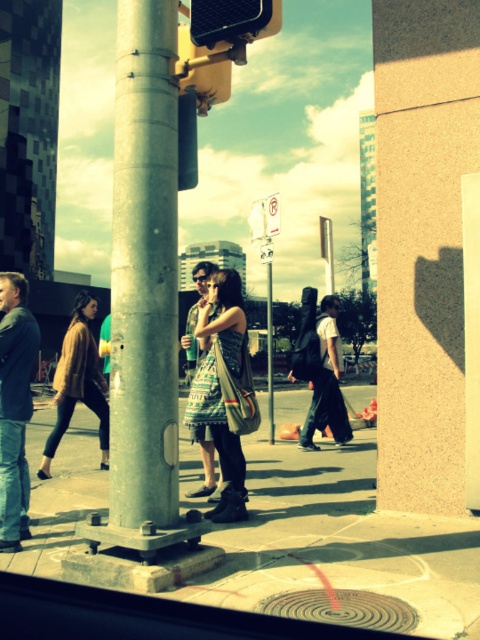
Where is `concrete pole at center`? This screenshot has height=640, width=480. concrete pole at center is located at coordinates (144, 268).

Which of these two, concrete pole at center or metallic pole at center, stands taller?

metallic pole at center is taller.

Which is in front, point (116, 305) or point (271, 412)?

Point (116, 305) is more forward.

Where is `concrete pole at center`? The width and height of the screenshot is (480, 640). concrete pole at center is located at coordinates (144, 268).

Does point (256, 564) come in front of point (269, 259)?

Yes, it is.

Which is more to the right, smooth concrete sidewalk at center or metallic rectangular sign at center?

metallic rectangular sign at center is more to the right.

Is point (462, 541) positioned before point (269, 243)?

Yes, it is.

Locate an element on the screen. This screenshot has height=640, width=480. smooth concrete sidewalk at center is located at coordinates (339, 540).

Does dark gray backpack at center come behind matte brown cardigan at lower left?

Yes.

Is point (330, 342) positioned in front of point (96, 385)?

No, (330, 342) is further to viewer.

Is point (328, 346) less distant than point (52, 429)?

No, (328, 346) is behind (52, 429).

Image resolution: width=480 pixels, height=640 pixels. What are the coordinates of `dark gray backpack at center` in the screenshot? It's located at (321, 369).